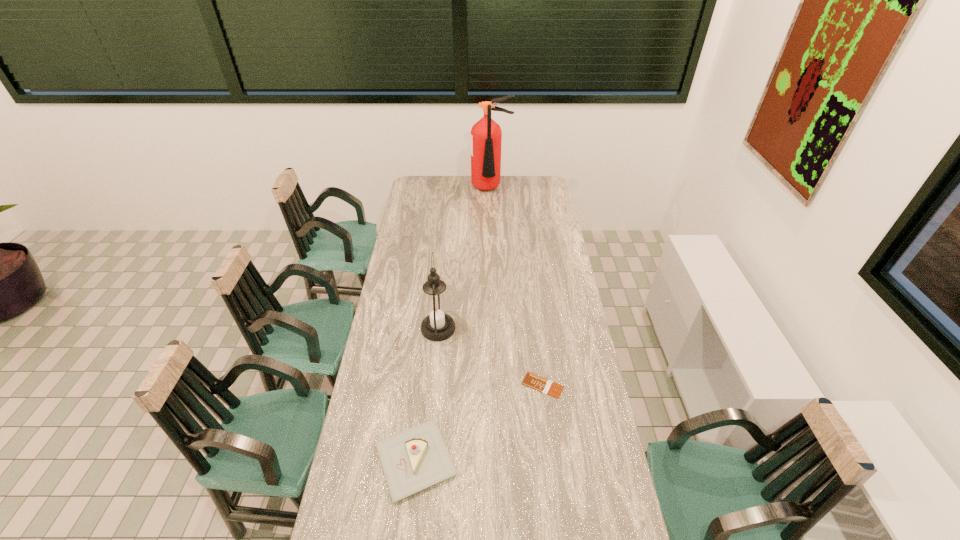
Find the location of a particular element. vacant region located on the back of the nearest object is located at coordinates pos(423,393).

Find the location of a particular element. This screenshot has width=960, height=540. vacant region located on the front of the shortest object is located at coordinates (553, 467).

This screenshot has height=540, width=960. What are the coordinates of `object positioned at the far edge` in the screenshot? It's located at (486, 136).

At what (x,y) coordinates should I click in order to perform the action: click on object that is at the left edge. Please return your answer as a coordinate pair (x, y). The image size is (960, 540). Looking at the image, I should click on (417, 458).

Locate an element on the screen. The width and height of the screenshot is (960, 540). object situated at the right edge is located at coordinates 534,381.

Locate an element on the screen. Image resolution: width=960 pixels, height=540 pixels. vacant space at the left edge is located at coordinates (353, 482).

This screenshot has height=540, width=960. In the image, there is a desktop. Identify the location of vacant space at the right edge. (589, 363).

Where is `vacant space at the far left corner of the desktop`? vacant space at the far left corner of the desktop is located at coordinates (434, 185).

The width and height of the screenshot is (960, 540). I want to click on vacant space in between the second farthest object and the tallest object, so click(465, 259).

This screenshot has height=540, width=960. Identify the location of free space between the shortest object and the farthest object. (516, 288).